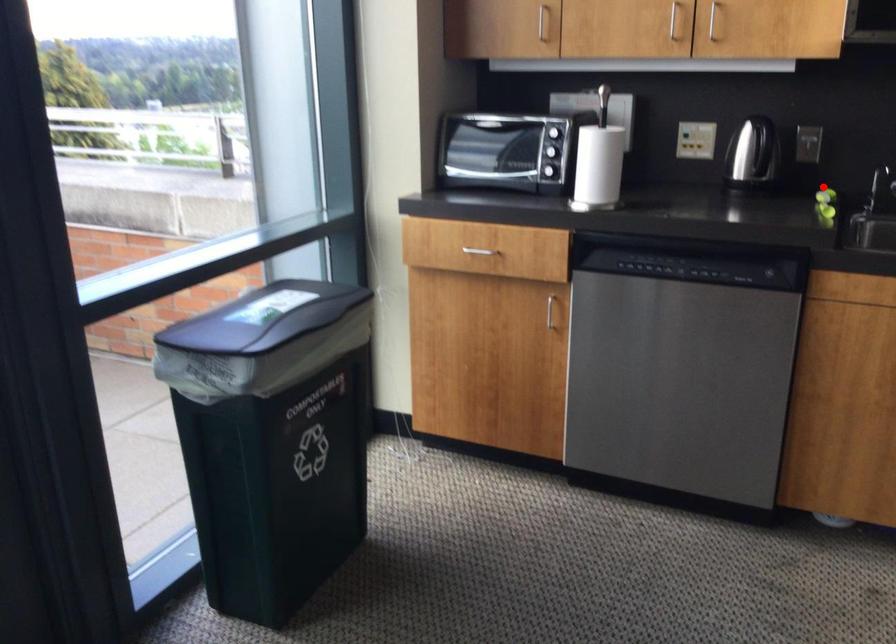
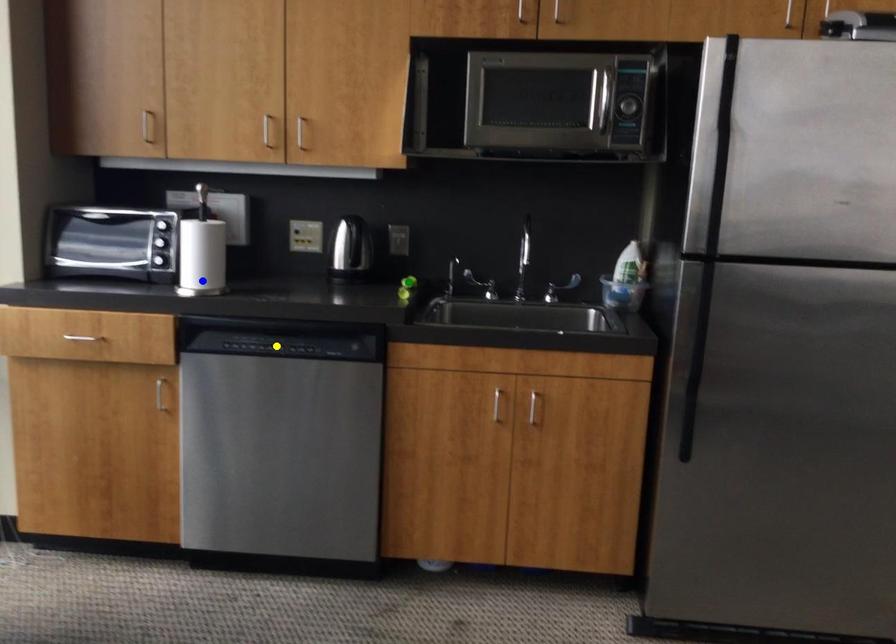
Question: I am providing you with two images of the same scene from different viewpoints. A red point is marked on the first image. You are given multiple points on the second image. Can you choose the point in image 2 that corresponds to the point in image 1?

Choices:
 (A) blue point
 (B) green point
 (C) yellow point

Answer: (B)